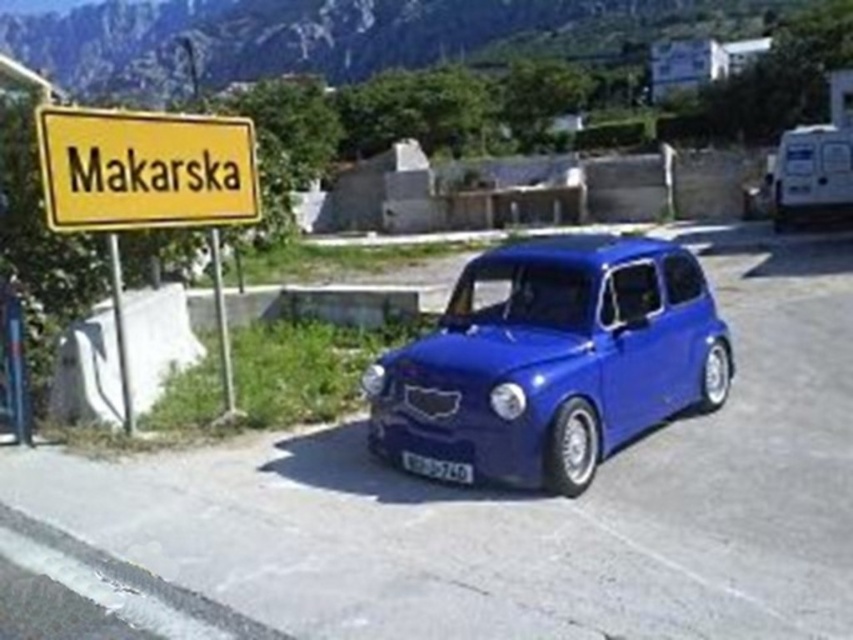
In the scene shown: Can you confirm if yellow plastic sign at upper left is wider than white plastic license plate at center?

Yes.

Does yellow plastic sign at upper left appear under white plastic license plate at center?

No.

Which is in front, point (236, 132) or point (410, 468)?

Point (410, 468) is more forward.

The image size is (853, 640). Find the location of `yellow plastic sign at upper left`. yellow plastic sign at upper left is located at coordinates (144, 168).

Which is behind, point (612, 243) or point (202, 136)?

The point (202, 136) is more distant.

Based on the photo, which of these two, glossy blue car at center or yellow plastic sign at upper left, stands taller?

yellow plastic sign at upper left is taller.

What do you see at coordinates (552, 358) in the screenshot? Image resolution: width=853 pixels, height=640 pixels. I see `glossy blue car at center` at bounding box center [552, 358].

The width and height of the screenshot is (853, 640). What are the coordinates of `glossy blue car at center` in the screenshot? It's located at (552, 358).

Can you confirm if glossy blue car at center is wider than white plastic license plate at center?

Indeed, glossy blue car at center has a greater width compared to white plastic license plate at center.

Can you confirm if glossy blue car at center is positioned to the left of white plastic license plate at center?

In fact, glossy blue car at center is to the right of white plastic license plate at center.

Which is behind, point (477, 451) or point (419, 458)?

Positioned behind is point (419, 458).

Identify the location of glossy blue car at center. This screenshot has width=853, height=640. [x=552, y=358].